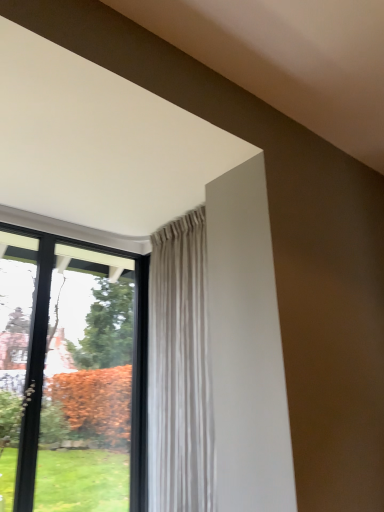
Question: Is black glass window at left taller or shorter than beige textured curtain at upper center?

Choices:
 (A) tall
 (B) short

Answer: (B)

Question: Is black glass window at left in front of or behind beige textured curtain at upper center in the image?

Choices:
 (A) front
 (B) behind

Answer: (B)

Question: Is black glass window at left inside or outside of beige textured curtain at upper center?

Choices:
 (A) inside
 (B) outside

Answer: (B)

Question: From the image's perspective, is beige textured curtain at upper center positioned above or below black glass window at left?

Choices:
 (A) below
 (B) above

Answer: (B)

Question: Considering the relative positions of beige textured curtain at upper center and black glass window at left in the image provided, is beige textured curtain at upper center to the left or to the right of black glass window at left?

Choices:
 (A) right
 (B) left

Answer: (A)

Question: From a real-world perspective, is beige textured curtain at upper center positioned above or below black glass window at left?

Choices:
 (A) above
 (B) below

Answer: (A)

Question: Considering the positions of beige textured curtain at upper center and black glass window at left in the image, is beige textured curtain at upper center bigger or smaller than black glass window at left?

Choices:
 (A) small
 (B) big

Answer: (B)